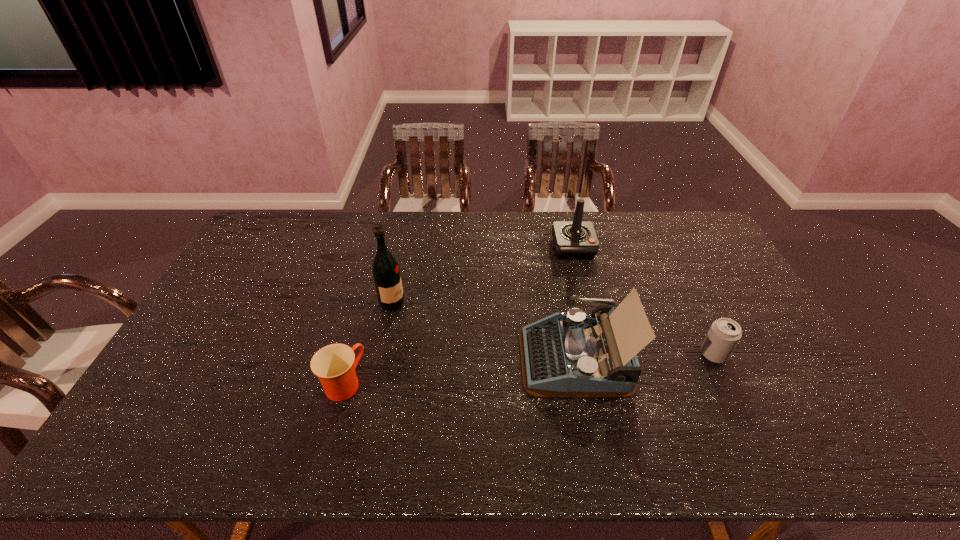
The image size is (960, 540). I want to click on vacant space that satisfies the following two spatial constraints: 1. on the front-facing side of the farthest object; 2. on the typing side of the typewriter, so (x=601, y=357).

At what (x,y) coordinates should I click in order to perform the action: click on vacant space that satisfies the following two spatial constraints: 1. on the front-facing side of the rightmost object; 2. on the right side of the tallest object. Please return your answer as a coordinate pair (x, y). This screenshot has height=540, width=960. Looking at the image, I should click on (382, 354).

Locate an element on the screen. free region that satisfies the following two spatial constraints: 1. on the front-facing side of the farthest object; 2. on the front-facing side of the liquor is located at coordinates (588, 304).

Image resolution: width=960 pixels, height=540 pixels. Find the location of `vacant position in the image that satisfies the following two spatial constraints: 1. on the typing side of the typewriter; 2. on the front side of the cup`. vacant position in the image that satisfies the following two spatial constraints: 1. on the typing side of the typewriter; 2. on the front side of the cup is located at coordinates (580, 383).

Locate an element on the screen. Image resolution: width=960 pixels, height=540 pixels. free spot that satisfies the following two spatial constraints: 1. on the front-facing side of the farthest object; 2. on the left side of the can is located at coordinates (600, 354).